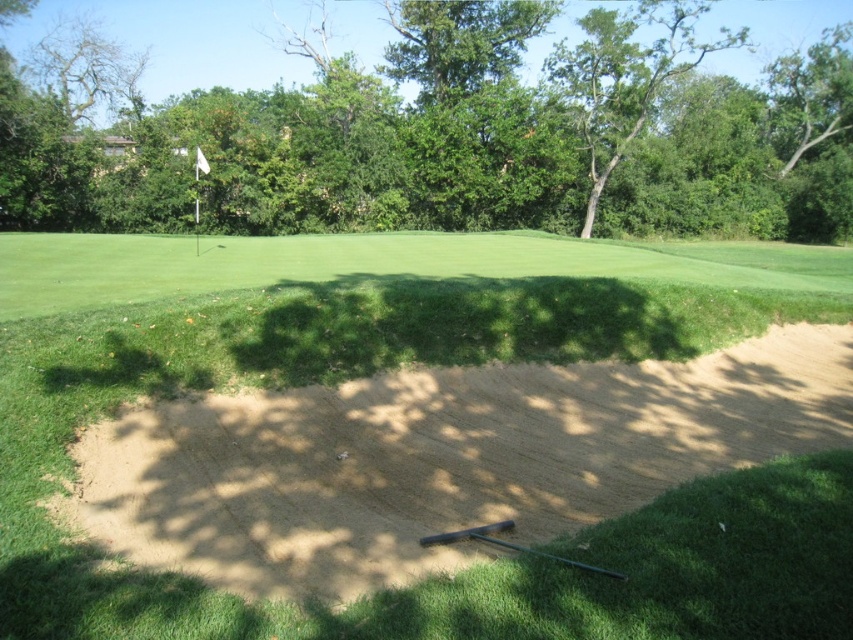
Question: Can you confirm if green grass at center is bigger than green leafy tree at upper center?

Choices:
 (A) yes
 (B) no

Answer: (B)

Question: Which of the following is the farthest from the observer?

Choices:
 (A) green grass at center
 (B) green leafy tree at upper center

Answer: (B)

Question: Which point is closer to the camera taking this photo?

Choices:
 (A) (627, 531)
 (B) (606, 131)

Answer: (A)

Question: Does green grass at center come in front of green leafy tree at upper center?

Choices:
 (A) yes
 (B) no

Answer: (A)

Question: Which point is farther from the camera taking this photo?

Choices:
 (A) (184, 170)
 (B) (738, 634)

Answer: (A)

Question: In this image, where is green grass at center located relative to green leafy tree at upper center?

Choices:
 (A) below
 (B) above

Answer: (A)